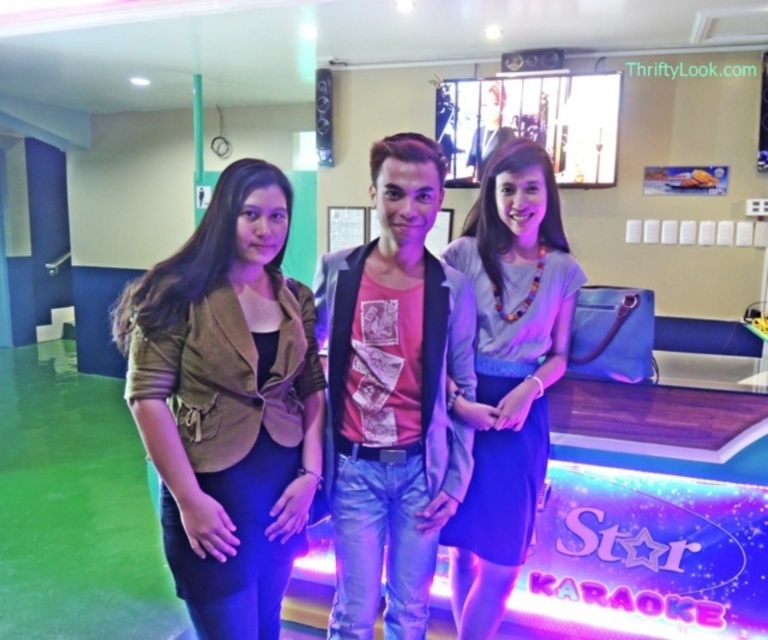
Does brown suede blazer at left have a lesser width compared to matte gray dress at center?

No.

Is brown suede blazer at left taller than matte gray dress at center?

Answer: No, brown suede blazer at left is not taller than matte gray dress at center.

Which is behind, point (181, 545) or point (447, 248)?

Point (447, 248)

Locate an element on the screen. Image resolution: width=768 pixels, height=640 pixels. brown suede blazer at left is located at coordinates (227, 403).